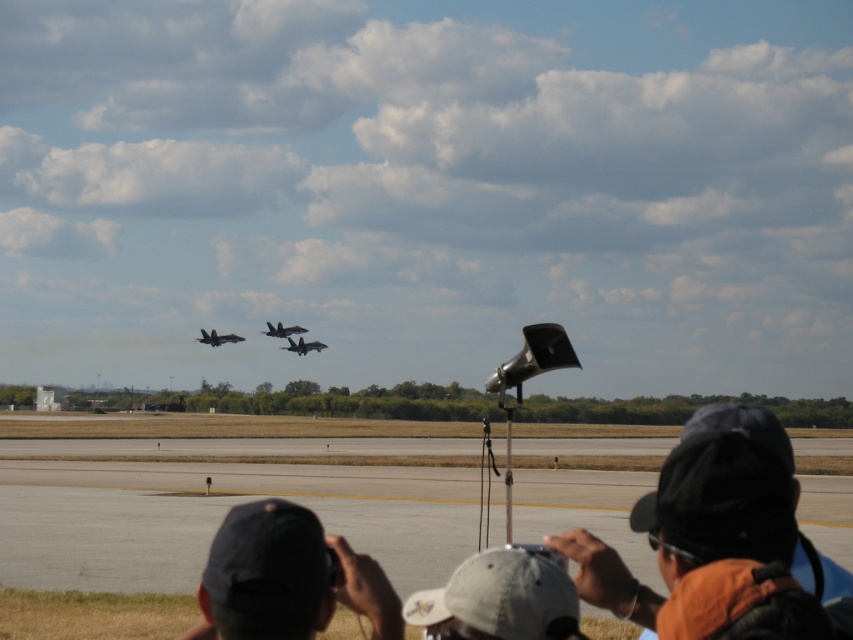
Does point (634, 620) come farther from viewer compared to point (283, 326)?

That is False.

The width and height of the screenshot is (853, 640). In order to click on dark gray cap at lower right in this screenshot , I will do `click(734, 499)`.

Does asphalt tarmac at lower center have a lesser height compared to shiny metallic jet at center?

Incorrect, asphalt tarmac at lower center's height does not fall short of shiny metallic jet at center's.

Which is in front, point (628, 528) or point (299, 355)?

Point (628, 528) is more forward.

Between point (537, 477) and point (305, 349), which one is positioned behind?

The point (305, 349) is behind.

Identify the location of asphalt tarmac at lower center. The image size is (853, 640). (219, 508).

Who is more forward, (828, 577) or (410, 604)?

Point (410, 604) is in front.

Is the position of dark gray cap at lower right more distant than that of white fabric cap at lower center?

No.

At what (x,y) coordinates should I click in order to perform the action: click on dark gray cap at lower right. Please return your answer as a coordinate pair (x, y). The height and width of the screenshot is (640, 853). Looking at the image, I should click on (734, 499).

Where is `dark gray cap at lower right`? dark gray cap at lower right is located at coordinates (734, 499).